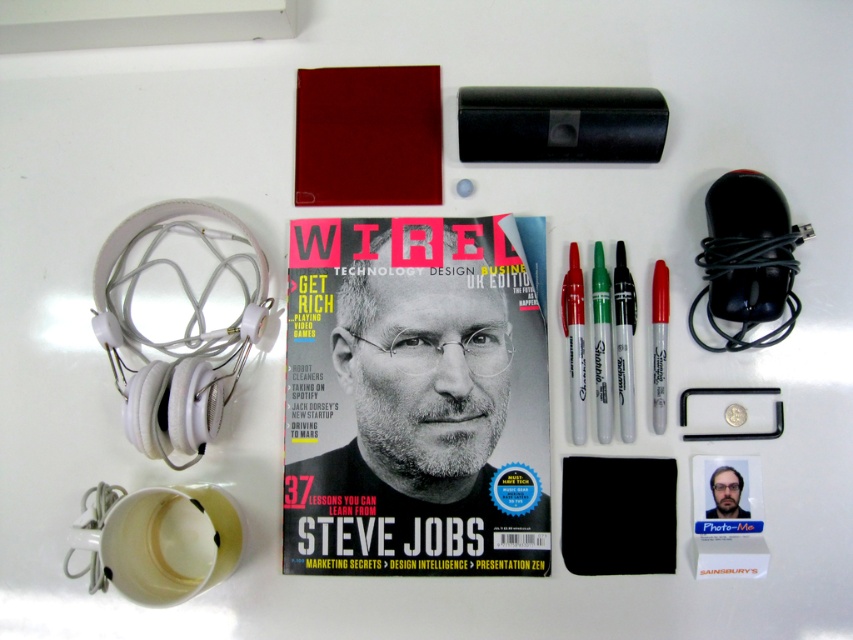
Question: Is matte paper magazine at center bigger than silver metallic marker at center?

Choices:
 (A) yes
 (B) no

Answer: (A)

Question: Does matte paper magazine at center have a lesser width compared to silver metallic marker at center?

Choices:
 (A) no
 (B) yes

Answer: (A)

Question: Which object appears farthest from the camera in this image?

Choices:
 (A) matte paper magazine at center
 (B) silver metallic marker at center

Answer: (B)

Question: Which of the following is the closest to the observer?

Choices:
 (A) matte paper magazine at center
 (B) silver metallic marker at center

Answer: (A)

Question: Can you confirm if matte paper magazine at center is wider than silver metallic marker at center?

Choices:
 (A) yes
 (B) no

Answer: (A)